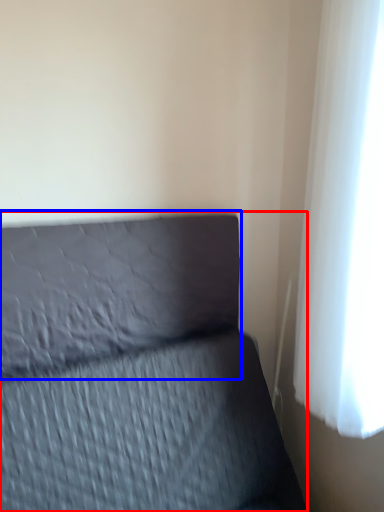
Question: Which point is closer to the camera, furniture (highlighted by a red box) or pillow (highlighted by a blue box)?

Choices:
 (A) furniture
 (B) pillow

Answer: (A)